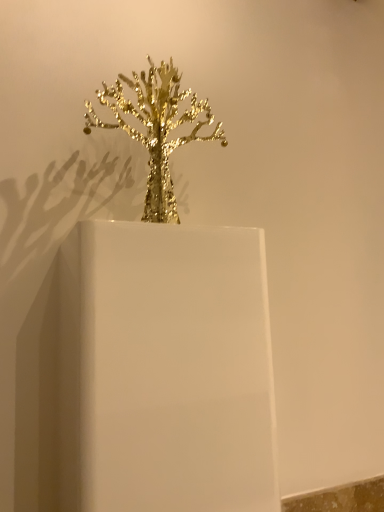
Question: Is gold metallic tree at center spatially inside white glossy candle holder at center, or outside of it?

Choices:
 (A) inside
 (B) outside

Answer: (B)

Question: Would you say gold metallic tree at center is to the left or to the right of white glossy candle holder at center in the picture?

Choices:
 (A) left
 (B) right

Answer: (B)

Question: In terms of height, does gold metallic tree at center look taller or shorter compared to white glossy candle holder at center?

Choices:
 (A) short
 (B) tall

Answer: (A)

Question: From the image's perspective, relative to gold metallic tree at center, is white glossy candle holder at center above or below?

Choices:
 (A) above
 (B) below

Answer: (B)

Question: In terms of height, does white glossy candle holder at center look taller or shorter compared to gold metallic tree at center?

Choices:
 (A) short
 (B) tall

Answer: (B)

Question: Is white glossy candle holder at center wider or thinner than gold metallic tree at center?

Choices:
 (A) wide
 (B) thin

Answer: (A)

Question: Is white glossy candle holder at center bigger or smaller than gold metallic tree at center?

Choices:
 (A) small
 (B) big

Answer: (B)